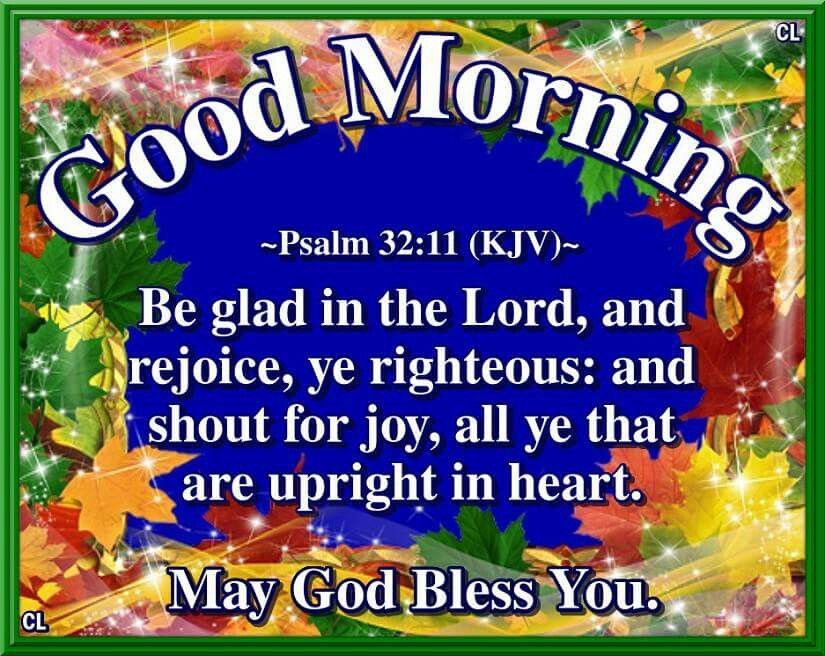
Image resolution: width=825 pixels, height=656 pixels. Identify the location of left edge of green frame. (2, 394).